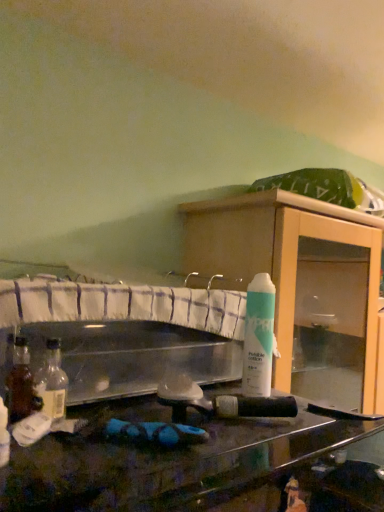
I want to click on wooden cabinet at center, so click(301, 285).

This screenshot has height=512, width=384. Describe the element at coordinates (258, 337) in the screenshot. I see `white matte spray can at upper right` at that location.

At what (x,y) coordinates should I click in order to perform the action: click on translucent glass bottle at left, the first bottle when ordered from right to left. Please return your answer as a coordinate pair (x, y). Looking at the image, I should click on (52, 382).

This screenshot has width=384, height=512. What do you see at coordinates (4, 435) in the screenshot? I see `translucent plastic bottle at lower left, positioned as the 1th bottle in front-to-back order` at bounding box center [4, 435].

Identify the location of wooden cabinet at center. (301, 285).

Which object is closer to the camera, wooden cabinet at center or translucent glass bottle at left, placed as the 1th bottle when sorted from back to front?

translucent glass bottle at left, placed as the 1th bottle when sorted from back to front.

From the image's perspective, which is above, wooden cabinet at center or translucent glass bottle at left, the 2th bottle viewed from the left?

translucent glass bottle at left, the 2th bottle viewed from the left, from the image's perspective.

Which of these two, wooden cabinet at center or translucent glass bottle at left, the 2th bottle viewed from the left, is thinner?

translucent glass bottle at left, the 2th bottle viewed from the left.

Is wooden cabinet at center inside or outside of translucent glass bottle at left, the 2th bottle from the front?

wooden cabinet at center is not inside translucent glass bottle at left, the 2th bottle from the front, it's outside.

Is translucent plastic bottle at lower left, which appears as the 1th bottle when viewed from the left, taller or shorter than wooden cabinet at center?

In the image, translucent plastic bottle at lower left, which appears as the 1th bottle when viewed from the left, appears to be shorter than wooden cabinet at center.

Which object is positioned more to the left, translucent plastic bottle at lower left, positioned as the 1th bottle in front-to-back order, or wooden cabinet at center?

translucent plastic bottle at lower left, positioned as the 1th bottle in front-to-back order, is more to the left.

Is wooden cabinet at center completely or partially inside translucent plastic bottle at lower left, positioned as the 1th bottle in front-to-back order?

No, wooden cabinet at center is located outside of translucent plastic bottle at lower left, positioned as the 1th bottle in front-to-back order.

Which is behind, white matte spray can at upper right or wooden cabinet at center?

wooden cabinet at center is further away from the camera.

Is white matte spray can at upper right taller than wooden cabinet at center?

No.

Is white matte spray can at upper right at the left side of wooden cabinet at center?

Correct, you'll find white matte spray can at upper right to the left of wooden cabinet at center.

Could you tell me if white matte spray can at upper right is turned towards wooden cabinet at center?

No, white matte spray can at upper right is not facing towards wooden cabinet at center.

From a real-world perspective, relative to translucent glass bottle at left, placed as the 1th bottle when sorted from back to front, is translucent plastic bottle at lower left, positioned as the 1th bottle in front-to-back order, vertically above or below?

translucent plastic bottle at lower left, positioned as the 1th bottle in front-to-back order, is below translucent glass bottle at left, placed as the 1th bottle when sorted from back to front.

Is translucent plastic bottle at lower left, positioned as the 1th bottle in front-to-back order, facing towards translucent glass bottle at left, the 2th bottle viewed from the left?

No, translucent plastic bottle at lower left, positioned as the 1th bottle in front-to-back order, is not aimed at translucent glass bottle at left, the 2th bottle viewed from the left.

Are translucent plastic bottle at lower left, which ranks as the 2th bottle in right-to-left order, and translucent glass bottle at left, the 2th bottle viewed from the left, far apart?

That's not correct — translucent plastic bottle at lower left, which ranks as the 2th bottle in right-to-left order, is a little close to translucent glass bottle at left, the 2th bottle viewed from the left.

Could you tell me if wooden cabinet at center is turned towards translucent plastic bottle at lower left, which appears as the 1th bottle when viewed from the left?

No, wooden cabinet at center does not turn towards translucent plastic bottle at lower left, which appears as the 1th bottle when viewed from the left.

Based on the photo, would you say wooden cabinet at center is inside or outside translucent plastic bottle at lower left, which appears as the second bottle when viewed from the back?

wooden cabinet at center is not enclosed by translucent plastic bottle at lower left, which appears as the second bottle when viewed from the back.

Which is more to the left, wooden cabinet at center or translucent plastic bottle at lower left, positioned as the 1th bottle in front-to-back order?

Positioned to the left is translucent plastic bottle at lower left, positioned as the 1th bottle in front-to-back order.

Is wooden cabinet at center bigger than translucent plastic bottle at lower left, which appears as the second bottle when viewed from the back?

Correct, wooden cabinet at center is larger in size than translucent plastic bottle at lower left, which appears as the second bottle when viewed from the back.

Is white matte spray can at upper right positioned beyond the bounds of translucent glass bottle at left, the first bottle when ordered from right to left?

Yes, white matte spray can at upper right is located beyond the bounds of translucent glass bottle at left, the first bottle when ordered from right to left.

Does white matte spray can at upper right appear on the right side of translucent glass bottle at left, the first bottle when ordered from right to left?

Indeed, white matte spray can at upper right is positioned on the right side of translucent glass bottle at left, the first bottle when ordered from right to left.

Can you tell me how much white matte spray can at upper right and translucent glass bottle at left, placed as the 1th bottle when sorted from back to front, differ in facing direction?

The angular difference between white matte spray can at upper right and translucent glass bottle at left, placed as the 1th bottle when sorted from back to front, is 0.00255 degrees.

From a real-world perspective, is white matte spray can at upper right physically located above or below translucent glass bottle at left, placed as the 1th bottle when sorted from back to front?

white matte spray can at upper right is above translucent glass bottle at left, placed as the 1th bottle when sorted from back to front.

Which object is further away from the camera taking this photo, translucent glass bottle at left, placed as the 1th bottle when sorted from back to front, or wooden cabinet at center?

wooden cabinet at center is further from the camera.

Based on their positions, is translucent glass bottle at left, the 2th bottle viewed from the left, located to the left or right of wooden cabinet at center?

translucent glass bottle at left, the 2th bottle viewed from the left, is to the left of wooden cabinet at center.

Could you tell me if translucent glass bottle at left, placed as the 1th bottle when sorted from back to front, is turned towards wooden cabinet at center?

No, translucent glass bottle at left, placed as the 1th bottle when sorted from back to front, is not aimed at wooden cabinet at center.

Who is bigger, translucent glass bottle at left, the 2th bottle from the front, or wooden cabinet at center?

With larger size is wooden cabinet at center.

This screenshot has width=384, height=512. What are the coordinates of `cabinetry to the right of translucent glass bottle at left, the 2th bottle viewed from the left` in the screenshot? It's located at (301, 285).

I want to click on cabinetry that appears above the translucent plastic bottle at lower left, which appears as the second bottle when viewed from the back (from a real-world perspective), so click(x=301, y=285).

Estimate the real-world distances between objects in this image. Which object is further from white matte spray can at upper right, translucent plastic bottle at lower left, positioned as the 1th bottle in front-to-back order, or wooden cabinet at center?

translucent plastic bottle at lower left, positioned as the 1th bottle in front-to-back order, lies further to white matte spray can at upper right than the other object.

Which object lies nearer to the anchor point white matte spray can at upper right, wooden cabinet at center or translucent plastic bottle at lower left, which ranks as the 2th bottle in right-to-left order?

The object closer to white matte spray can at upper right is wooden cabinet at center.

Looking at the image, which one is located further to wooden cabinet at center, translucent plastic bottle at lower left, positioned as the 1th bottle in front-to-back order, or translucent glass bottle at left, the 2th bottle from the front?

The object further to wooden cabinet at center is translucent plastic bottle at lower left, positioned as the 1th bottle in front-to-back order.

When comparing their distances from wooden cabinet at center, does translucent glass bottle at left, placed as the 1th bottle when sorted from back to front, or translucent plastic bottle at lower left, positioned as the 1th bottle in front-to-back order, seem closer?

translucent glass bottle at left, placed as the 1th bottle when sorted from back to front, lies closer to wooden cabinet at center than the other object.

Based on their spatial positions, is wooden cabinet at center or white matte spray can at upper right further from translucent glass bottle at left, placed as the 1th bottle when sorted from back to front?

Based on the image, wooden cabinet at center appears to be further to translucent glass bottle at left, placed as the 1th bottle when sorted from back to front.

Consider the image. When comparing their distances from translucent plastic bottle at lower left, which appears as the 1th bottle when viewed from the left, does translucent glass bottle at left, the 2th bottle from the front, or wooden cabinet at center seem closer?

The object closer to translucent plastic bottle at lower left, which appears as the 1th bottle when viewed from the left, is translucent glass bottle at left, the 2th bottle from the front.

Considering their positions, is wooden cabinet at center positioned closer to white matte spray can at upper right than translucent glass bottle at left, the first bottle when ordered from right to left?

Among the two, wooden cabinet at center is located nearer to white matte spray can at upper right.

Considering their positions, is white matte spray can at upper right positioned further to translucent glass bottle at left, the first bottle when ordered from right to left, than translucent plastic bottle at lower left, positioned as the 1th bottle in front-to-back order?

white matte spray can at upper right is positioned further to the anchor translucent glass bottle at left, the first bottle when ordered from right to left.

This screenshot has height=512, width=384. What are the coordinates of `bottle between translucent plastic bottle at lower left, which ranks as the 2th bottle in right-to-left order, and wooden cabinet at center from left to right` in the screenshot? It's located at (52, 382).

The height and width of the screenshot is (512, 384). What are the coordinates of `cleaning product between translucent plastic bottle at lower left, which ranks as the 2th bottle in right-to-left order, and wooden cabinet at center from left to right` in the screenshot? It's located at (258, 337).

You are a GUI agent. You are given a task and a screenshot of the screen. Output one action in this format:
    pyautogui.click(x=<x>, y=<y>)
    Task: Click on the cleaning product between translucent glass bottle at left, the first bottle when ordered from right to left, and wooden cabinet at center
    This screenshot has height=512, width=384.
    Given the screenshot: What is the action you would take?
    pyautogui.click(x=258, y=337)

At what (x,y) coordinates should I click in order to perform the action: click on bottle between translucent plastic bottle at lower left, positioned as the 1th bottle in front-to-back order, and white matte spray can at upper right. Please return your answer as a coordinate pair (x, y). Looking at the image, I should click on (52, 382).